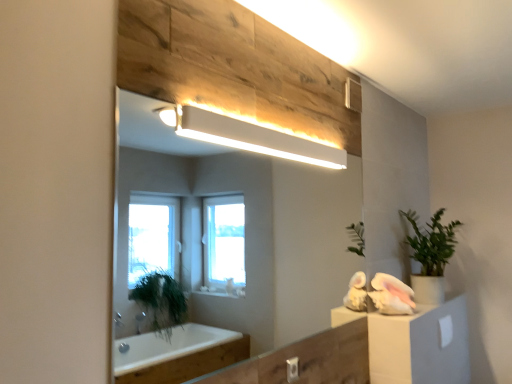
The image size is (512, 384). Describe the element at coordinates (254, 138) in the screenshot. I see `white matte rectangular light fixture at upper center` at that location.

What is the approximate width of white matte rectangular light fixture at upper center?

It is 2.31 inches.

Image resolution: width=512 pixels, height=384 pixels. Identify the location of green matte plant at right. (431, 256).

What do you see at coordinates (229, 230) in the screenshot? Image resolution: width=512 pixels, height=384 pixels. I see `white glossy mirror at upper center` at bounding box center [229, 230].

The width and height of the screenshot is (512, 384). I want to click on white fluffy towel at right, so click(x=391, y=295).

Is the surface of white matte rectangular light fixture at upper center in direct contact with white glossy mirror at upper center?

white matte rectangular light fixture at upper center and white glossy mirror at upper center are not in contact.

Is white matte rectangular light fixture at upper center to the left of white glossy mirror at upper center from the viewer's perspective?

No, white matte rectangular light fixture at upper center is not to the left of white glossy mirror at upper center.

From a real-world perspective, is white matte rectangular light fixture at upper center located beneath white glossy mirror at upper center?

No, from a real-world perspective, white matte rectangular light fixture at upper center is not below white glossy mirror at upper center.

From the image's perspective, who appears lower, white matte rectangular light fixture at upper center or white fluffy towel at right?

From the image's view, white fluffy towel at right is below.

Between white matte rectangular light fixture at upper center and white fluffy towel at right, which one has larger size?

white fluffy towel at right.

From a real-world perspective, is white matte rectangular light fixture at upper center located beneath white fluffy towel at right?

No, from a real-world perspective, white matte rectangular light fixture at upper center is not below white fluffy towel at right.

Relative to green matte plant at right, is white glossy mirror at upper center in front or behind?

white glossy mirror at upper center is in front of green matte plant at right.

Is white glossy mirror at upper center taller than green matte plant at right?

Yes.

How different are the orientations of white glossy mirror at upper center and green matte plant at right in degrees?

The facing directions of white glossy mirror at upper center and green matte plant at right are 0.646 degrees apart.

Is white glossy mirror at upper center facing towards green matte plant at right?

No, white glossy mirror at upper center does not turn towards green matte plant at right.

Between point (455, 226) and point (215, 300), which one is positioned behind?

The point (215, 300) is more distant.

Is green matte plant at right located outside white glossy mirror at upper center?

Indeed, green matte plant at right is completely outside white glossy mirror at upper center.

Between green matte plant at right and white glossy mirror at upper center, which one has less height?

With less height is green matte plant at right.

Is green matte plant at right closer to the viewer compared to white glossy mirror at upper center?

No, it is not.

Is point (227, 326) behind point (385, 287)?

Yes, it is.

Measure the distance between white glossy mirror at upper center and white fluffy towel at right.

They are 2.12 meters apart.

Is white glossy mirror at upper center smaller than white fluffy towel at right?

No.

Considering the relative sizes of white glossy mirror at upper center and white fluffy towel at right in the image provided, is white glossy mirror at upper center wider than white fluffy towel at right?

No, white glossy mirror at upper center is not wider than white fluffy towel at right.

How different are the orientations of white matte rectangular light fixture at upper center and green matte plant at right in degrees?

0.647 degrees separate the facing orientations of white matte rectangular light fixture at upper center and green matte plant at right.

Looking at this image, is white matte rectangular light fixture at upper center next to green matte plant at right and touching it?

No, white matte rectangular light fixture at upper center is not next to green matte plant at right.

Locate an element on the screen. light fixture that appears above the green matte plant at right (from the image's perspective) is located at coordinates (254, 138).

Locate an element on the screen. This screenshot has width=512, height=384. animal on the left of green matte plant at right is located at coordinates (391, 295).

Consider the image. Considering the relative sizes of green matte plant at right and white fluffy towel at right in the image provided, is green matte plant at right taller than white fluffy towel at right?

Indeed, green matte plant at right has a greater height compared to white fluffy towel at right.

Is point (454, 225) closer to viewer compared to point (388, 306)?

No.

Is green matte plant at right next to white fluffy towel at right and touching it?

green matte plant at right and white fluffy towel at right are not in contact.

Locate an element on the screen. This screenshot has height=384, width=512. mirror located underneath the white matte rectangular light fixture at upper center (from a real-world perspective) is located at coordinates (229, 230).

You are a GUI agent. You are given a task and a screenshot of the screen. Output one action in this format:
    pyautogui.click(x=<x>, y=<y>)
    Task: Click on the animal lying on the right of white matte rectangular light fixture at upper center
    
    Given the screenshot: What is the action you would take?
    pyautogui.click(x=391, y=295)

Looking at the image, which one is located closer to white matte rectangular light fixture at upper center, white fluffy towel at right or white glossy mirror at upper center?

white fluffy towel at right is closer to white matte rectangular light fixture at upper center.

From the picture: Estimate the real-world distances between objects in this image. Which object is further from green matte plant at right, white glossy mirror at upper center or white fluffy towel at right?

white glossy mirror at upper center is positioned further to the anchor green matte plant at right.

From the image, which object appears to be nearer to white fluffy towel at right, green matte plant at right or white matte rectangular light fixture at upper center?

The object closer to white fluffy towel at right is green matte plant at right.

Looking at the image, which one is located further to white matte rectangular light fixture at upper center, white glossy mirror at upper center or green matte plant at right?

white glossy mirror at upper center.

Based on the photo, based on their spatial positions, is white matte rectangular light fixture at upper center or white glossy mirror at upper center further from green matte plant at right?

Based on the image, white glossy mirror at upper center appears to be further to green matte plant at right.

From the image, which object appears to be farther from white matte rectangular light fixture at upper center, white fluffy towel at right or green matte plant at right?

green matte plant at right lies further to white matte rectangular light fixture at upper center than the other object.

Considering their positions, is green matte plant at right positioned closer to white matte rectangular light fixture at upper center than white fluffy towel at right?

white fluffy towel at right.

From the image, which object appears to be farther from white fluffy towel at right, green matte plant at right or white glossy mirror at upper center?

white glossy mirror at upper center lies further to white fluffy towel at right than the other object.

Where is `light fixture located between white glossy mirror at upper center and green matte plant at right in the depth direction`? Image resolution: width=512 pixels, height=384 pixels. light fixture located between white glossy mirror at upper center and green matte plant at right in the depth direction is located at coordinates (254, 138).

Where is `animal between white matte rectangular light fixture at upper center and green matte plant at right from front to back`? animal between white matte rectangular light fixture at upper center and green matte plant at right from front to back is located at coordinates (391, 295).

I want to click on animal located between white glossy mirror at upper center and green matte plant at right in the depth direction, so click(391, 295).

Locate an element on the screen. Image resolution: width=512 pixels, height=384 pixels. light fixture between white glossy mirror at upper center and white fluffy towel at right in the front-back direction is located at coordinates [x=254, y=138].